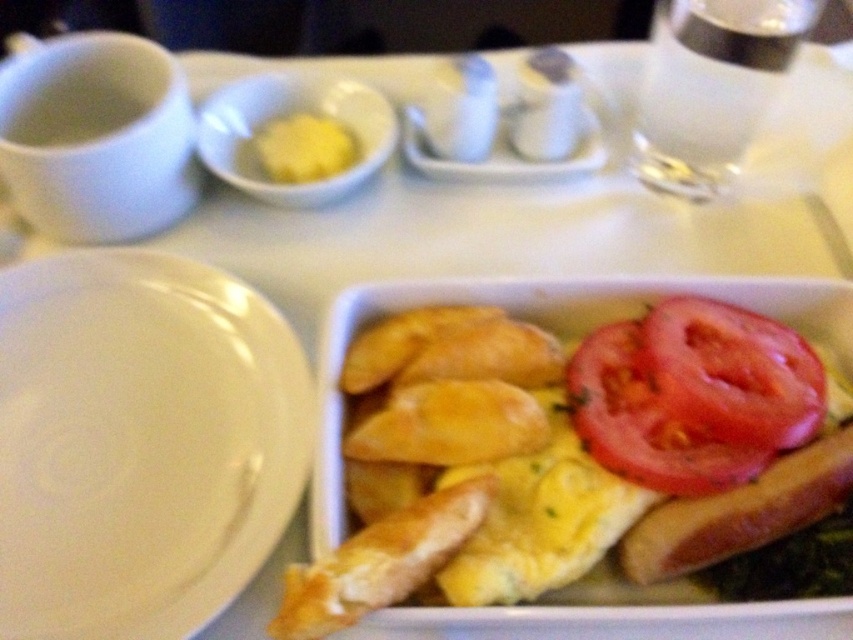
Who is positioned more to the left, yellow fried egg at center or white glossy plate at center left?

white glossy plate at center left

Is point (486, 528) farther from viewer compared to point (177, 627)?

Yes, it is behind point (177, 627).

Find the location of a particular element. The width and height of the screenshot is (853, 640). yellow fried egg at center is located at coordinates (531, 458).

Does yellow fried egg at center have a lesser width compared to white glossy salt and pepper shakers at center?

No, yellow fried egg at center is not thinner than white glossy salt and pepper shakers at center.

Is yellow fried egg at center shorter than white glossy salt and pepper shakers at center?

No, yellow fried egg at center is not shorter than white glossy salt and pepper shakers at center.

Is point (846, 392) positioned after point (421, 124)?

No.

You are a GUI agent. You are given a task and a screenshot of the screen. Output one action in this format:
    pyautogui.click(x=<x>, y=<y>)
    Task: Click on the yellow fried egg at center
    
    Given the screenshot: What is the action you would take?
    [x=531, y=458]

Which of these two, white glossy plate at center left or sliced red tomato at center, stands shorter?

With less height is sliced red tomato at center.

I want to click on white glossy plate at center left, so pyautogui.click(x=140, y=444).